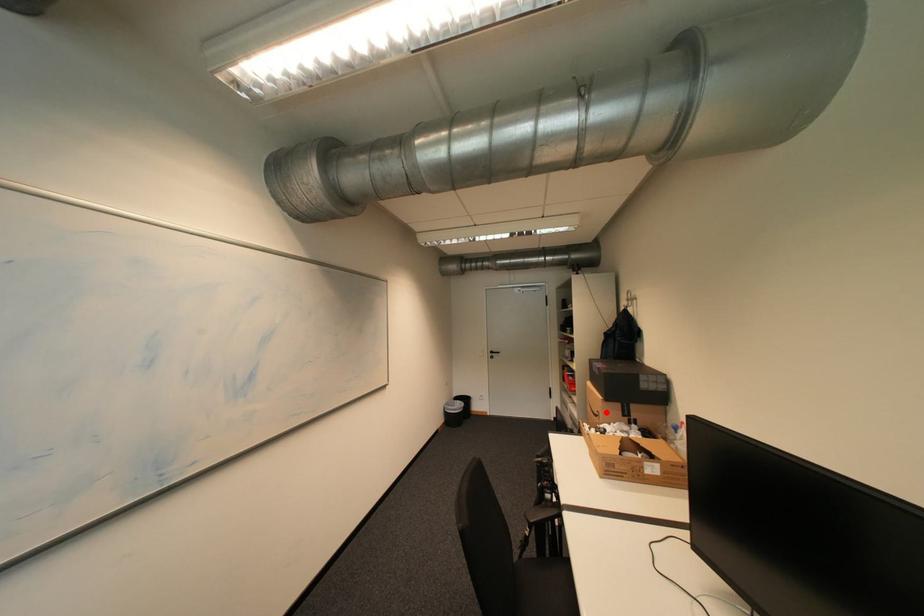
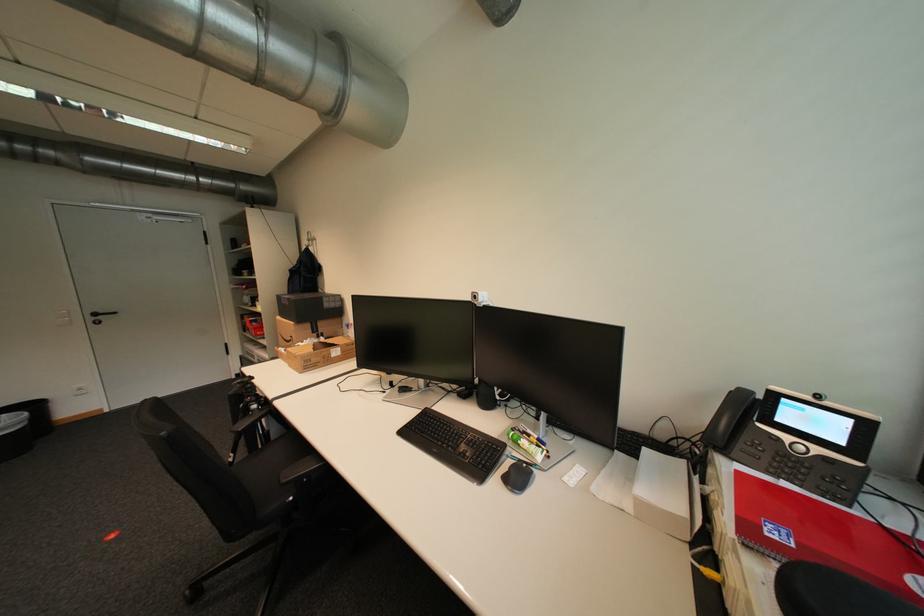
Question: I am providing you with two images of the same scene from different viewpoints. A red point is marked on the first image. Is the red point's position out of view in image 2?

Choices:
 (A) Yes
 (B) No

Answer: (B)